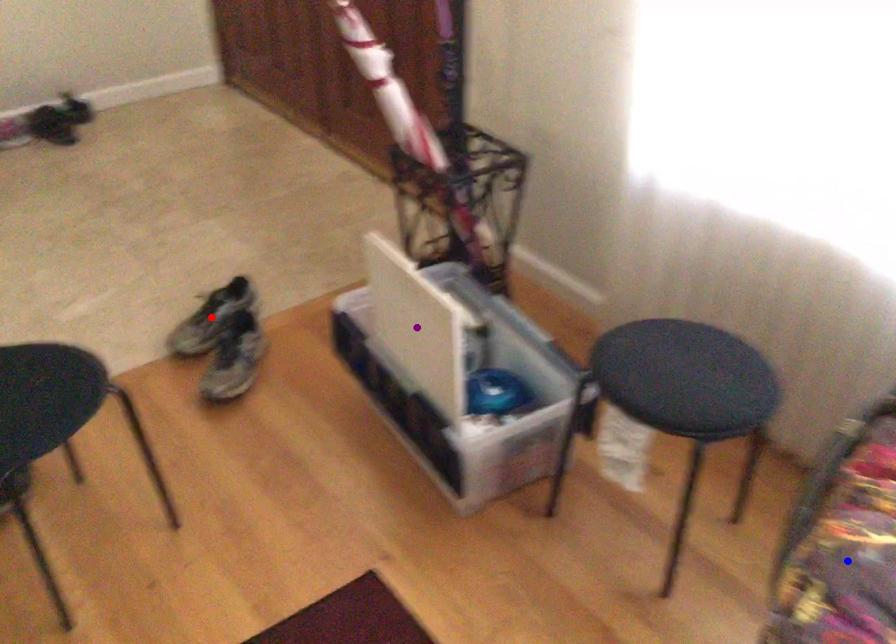
Order these from nearest to farthest:
blue point
purple point
red point

blue point < purple point < red point